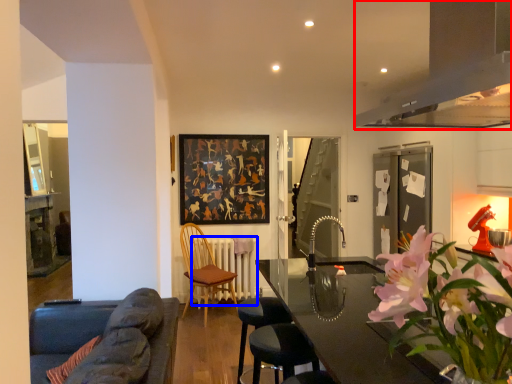
Question: Which of the following is the closest to the observer, exhaust hood (highlighted by a red box) or radiator (highlighted by a blue box)?

Choices:
 (A) exhaust hood
 (B) radiator

Answer: (A)